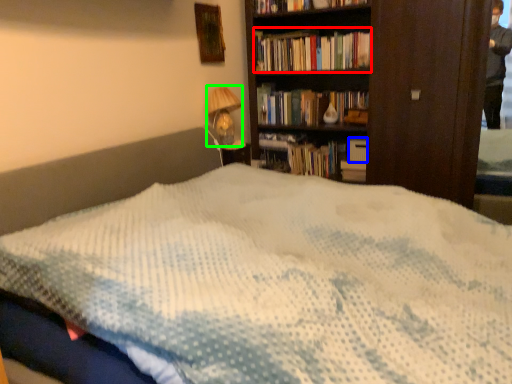
Question: Which object is positioned closest to book (highlighted by a red box)? Select from paperback book (highlighted by a blue box) and table lamp (highlighted by a green box).

Choices:
 (A) paperback book
 (B) table lamp

Answer: (B)